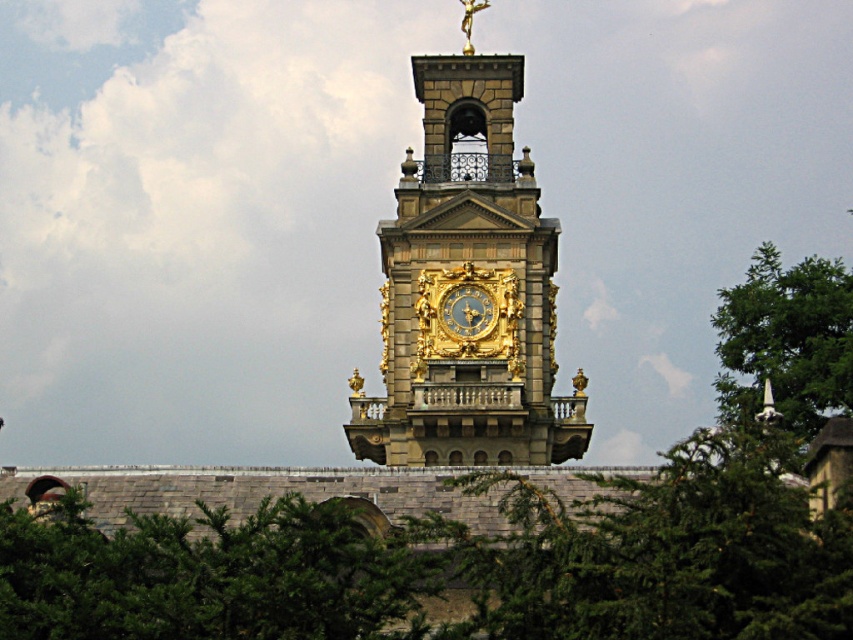
Question: Among these objects, which one is farthest from the camera?

Choices:
 (A) gold ornate clock tower at center
 (B) gold ornate clock at center
 (C) green leafy tree at right

Answer: (B)

Question: Which object is the closest to the gold ornate clock at center?

Choices:
 (A) green leafy tree at right
 (B) gold ornate clock tower at center

Answer: (B)

Question: Which of these objects is positioned farthest from the green leafy tree at right?

Choices:
 (A) gold ornate clock tower at center
 (B) gold ornate clock at center

Answer: (B)

Question: Can you confirm if gold ornate clock tower at center is positioned to the right of gold ornate clock at center?

Choices:
 (A) yes
 (B) no

Answer: (A)

Question: Does gold ornate clock tower at center have a larger size compared to gold ornate clock at center?

Choices:
 (A) no
 (B) yes

Answer: (B)

Question: Is green leafy tree at right thinner than gold ornate clock at center?

Choices:
 (A) no
 (B) yes

Answer: (A)